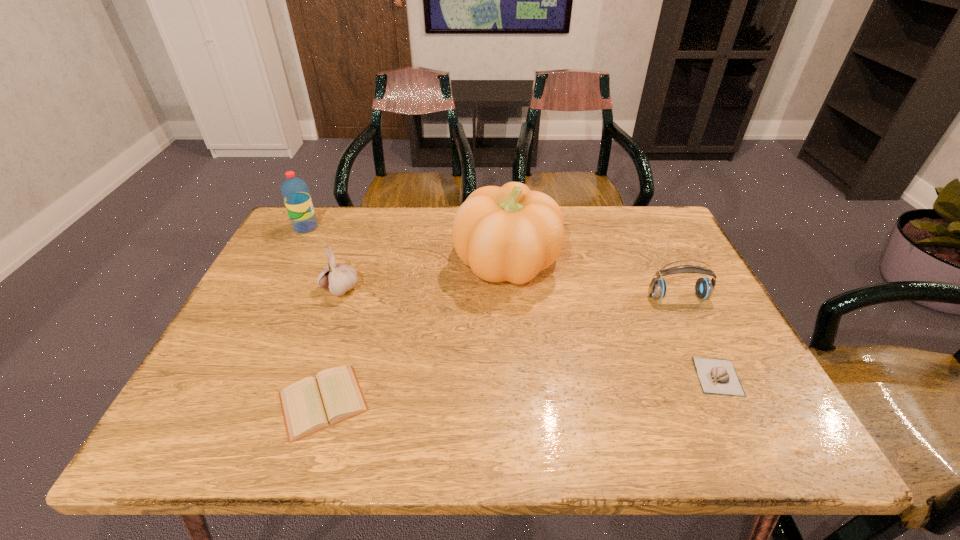
Locate an element on the screen. vacant space that satisfies the following two spatial constraints: 1. on the front label of the leftmost object; 2. on the left side of the diary is located at coordinates (215, 402).

Locate an element on the screen. This screenshot has height=540, width=960. vacant space that satisfies the following two spatial constraints: 1. on the back side of the diary; 2. on the left side of the fourth object from left to right is located at coordinates (366, 262).